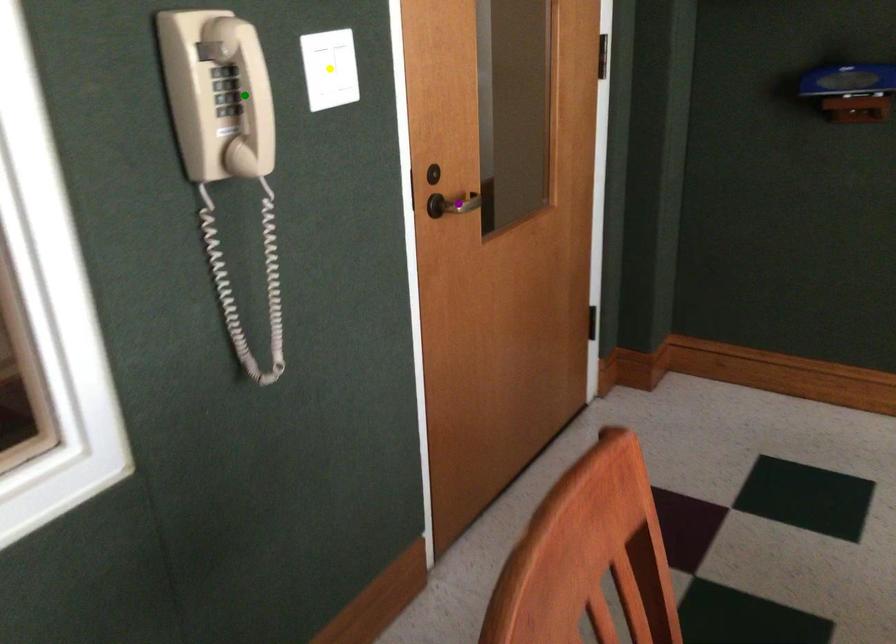
Order these from farthest to nearest:
A) purple point
B) yellow point
C) green point

1. purple point
2. yellow point
3. green point